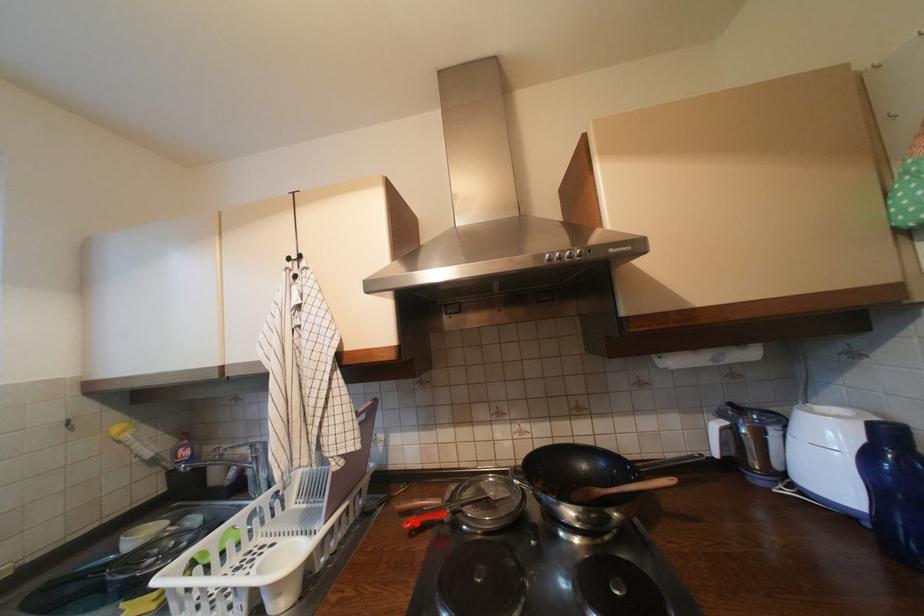
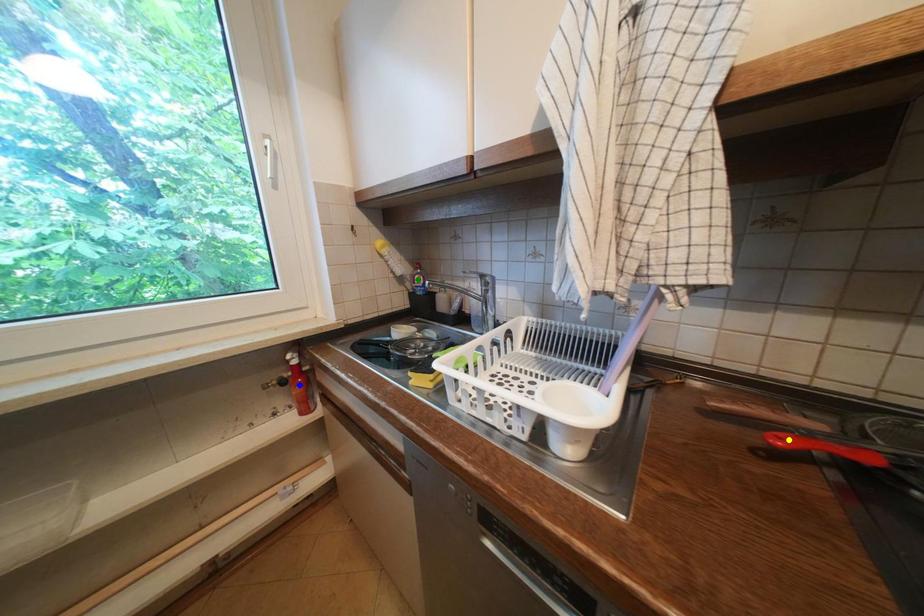
Question: I am providing you with two images of the same scene from different viewpoints. A red point is marked on the first image. You are given multiple points on the second image. Which point in image 2 is actually the same real-world point as the red point in image 1?

Choices:
 (A) blue point
 (B) yellow point
 (C) green point

Answer: (B)